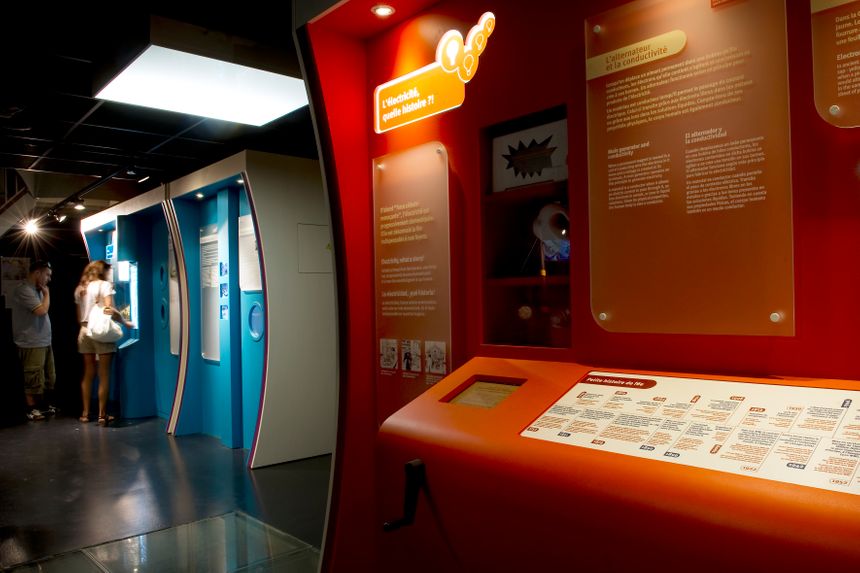
Image resolution: width=860 pixels, height=573 pixels. I want to click on light, so click(x=219, y=80), click(x=22, y=233).